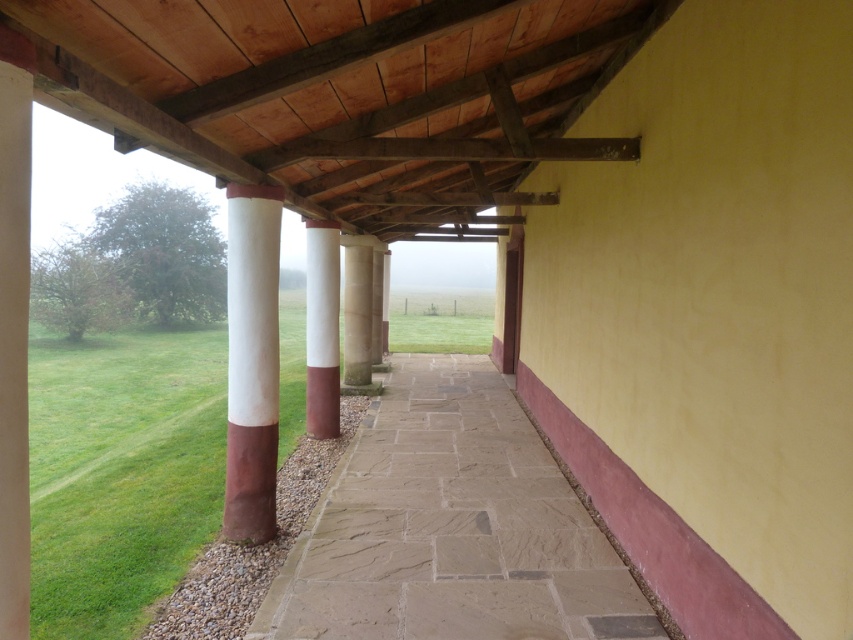
Question: Is green grass at lower left above white marble pillar at center?

Choices:
 (A) no
 (B) yes

Answer: (A)

Question: Which object appears farthest from the camera in this image?

Choices:
 (A) brown stone path at center
 (B) white marble pillar at center
 (C) white painted wood column at center

Answer: (B)

Question: Is green grass at lower left thinner than white glossy column at center?

Choices:
 (A) no
 (B) yes

Answer: (A)

Question: Among these objects, which one is farthest from the camera?

Choices:
 (A) brown stone path at center
 (B) white marble pillar at center
 (C) white glossy column at center

Answer: (B)

Question: From the image, what is the correct spatial relationship of brown stone path at center in relation to white painted wood column at center?

Choices:
 (A) above
 (B) below

Answer: (B)

Question: Which point is farther to the camera?

Choices:
 (A) (316, 428)
 (B) (350, 289)

Answer: (B)